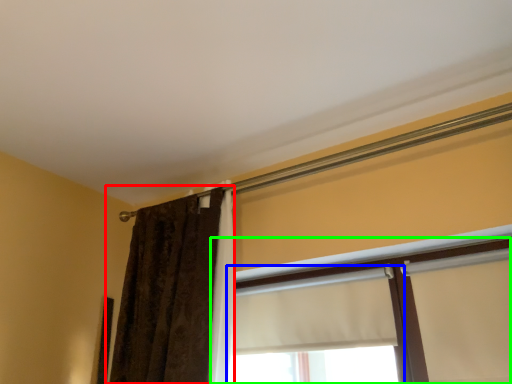
Question: Considering the real-world distances, which object is farthest from curtain (highlighted by a red box)? window (highlighted by a blue box) or window (highlighted by a green box)?

Choices:
 (A) window
 (B) window

Answer: (B)